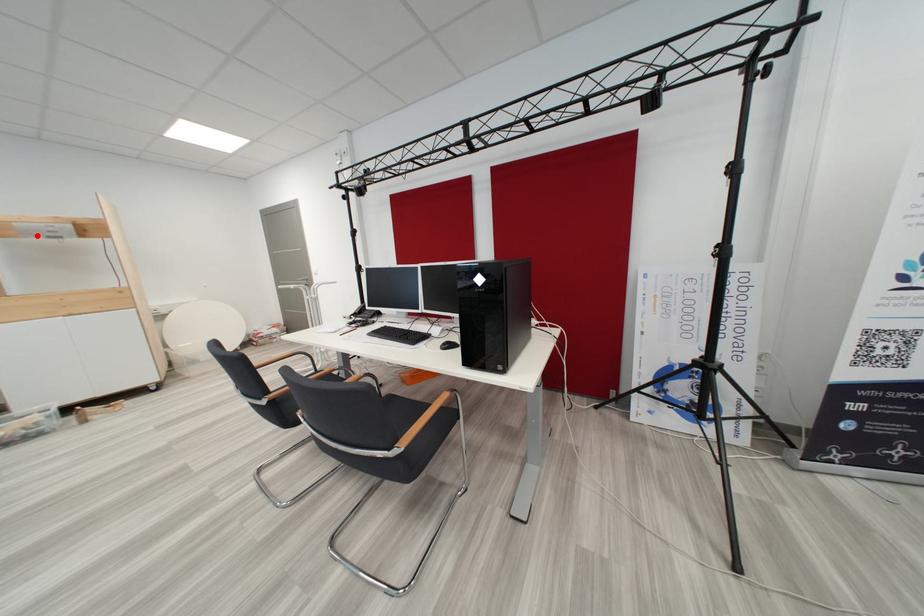
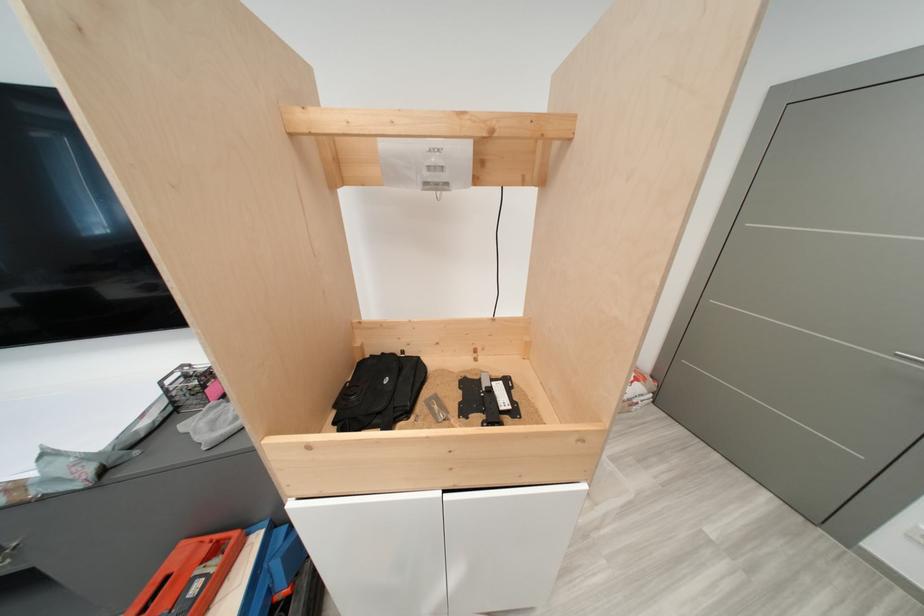
Locate, in the second image, the point that corresponds to the highlighted location in the first image.

(405, 176)